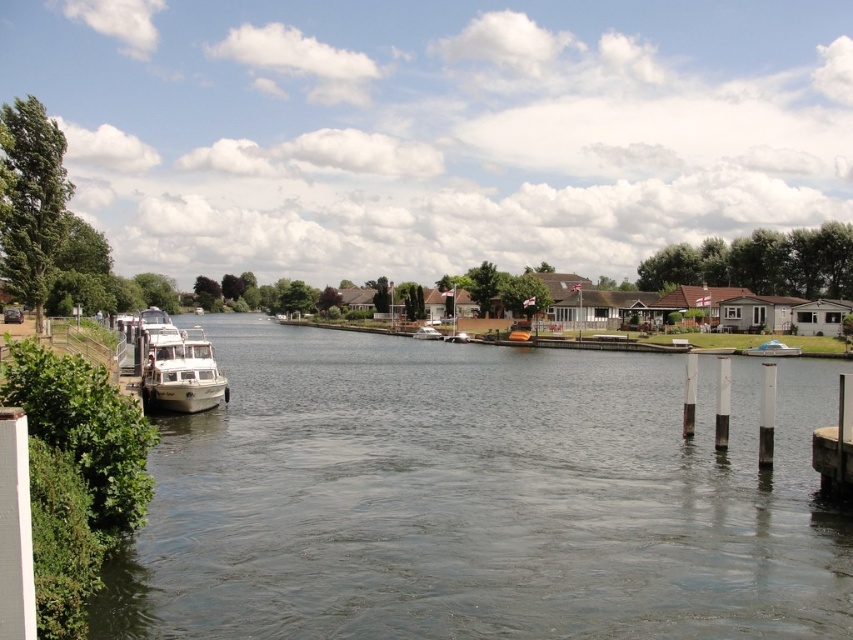
You are a photographer planning to capture a reflection shot of the blue glossy car at center in the clear water at left. Based on the scene, will the reflection of the car be fully visible in the water?

The clear water at left has a greater height compared to blue glossy car at center, so the reflection of the blue glossy car at center will be fully visible in the clear water at left since the water is deep enough to accommodate the car.

You are standing on the riverside dock and want to board the white glossy boat at left. Which direction should you move relative to the clear water at left to reach the boat?

The clear water at left is below the white glossy boat at left, so you should move upward from the clear water at left to reach the white glossy boat at left.

You are a photographer planning to capture the blue glossy car at center and the white glossy boat at center in a single shot. Given their heights, which object will appear smaller in the photo?

The blue glossy car at center will appear smaller in the photo because it is not as tall as the white glossy boat at center.